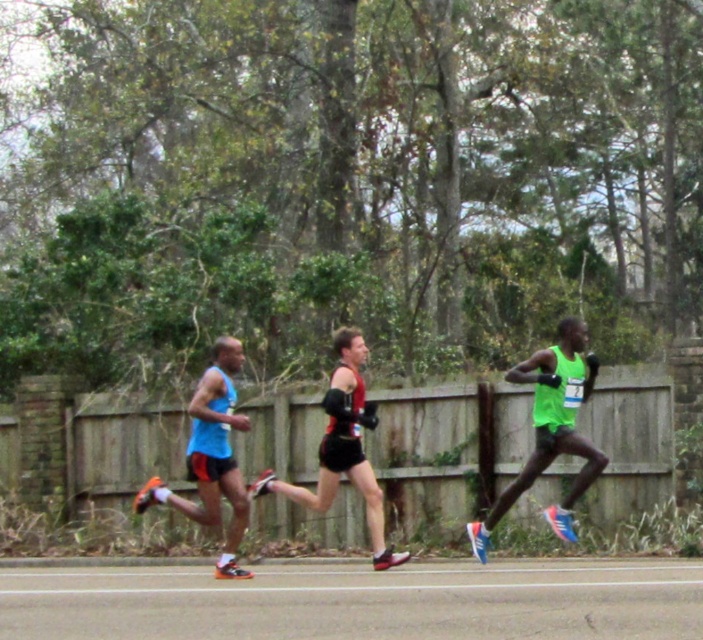
Question: Which point is closer to the camera?

Choices:
 (A) (311, 500)
 (B) (392, 436)

Answer: (A)

Question: Does wooden fence at center come behind blue matte shorts at center?

Choices:
 (A) yes
 (B) no

Answer: (A)

Question: Is neon green fabric at center to the right of blue matte shorts at center from the viewer's perspective?

Choices:
 (A) yes
 (B) no

Answer: (A)

Question: Which point is farther to the camera?

Choices:
 (A) (367, 422)
 (B) (143, 490)
 (C) (264, 516)

Answer: (C)

Question: Which of the following is the closest to the observer?

Choices:
 (A) neon green fabric at center
 (B) reddish-black running suit at center
 (C) wooden fence at center

Answer: (B)

Question: Can you confirm if neon green fabric at center is positioned to the right of blue matte shorts at center?

Choices:
 (A) yes
 (B) no

Answer: (A)